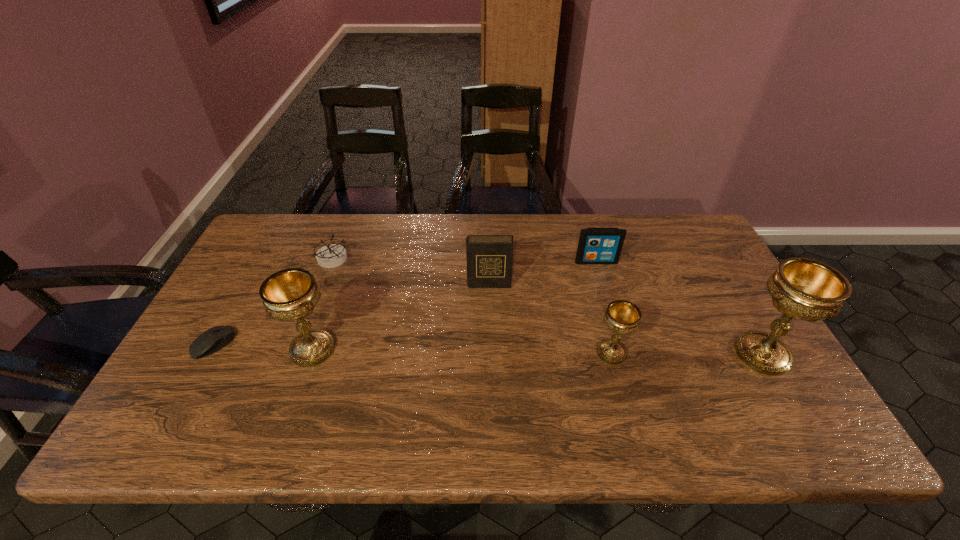
To ensure equal spacing by inserting another chalice among them, please point out a vacant spot for this new chalice. Please provide its 2D coordinates. Your answer should be formatted as a tuple, i.e. [(x, y)], where the tuple contains the x and y coordinates of a point satisfying the conditions above.

[(462, 351)]